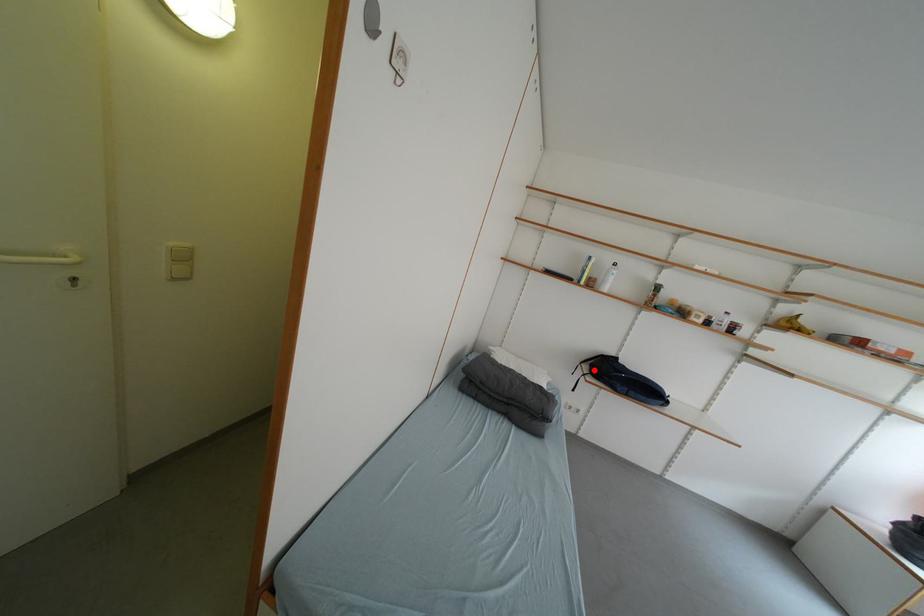
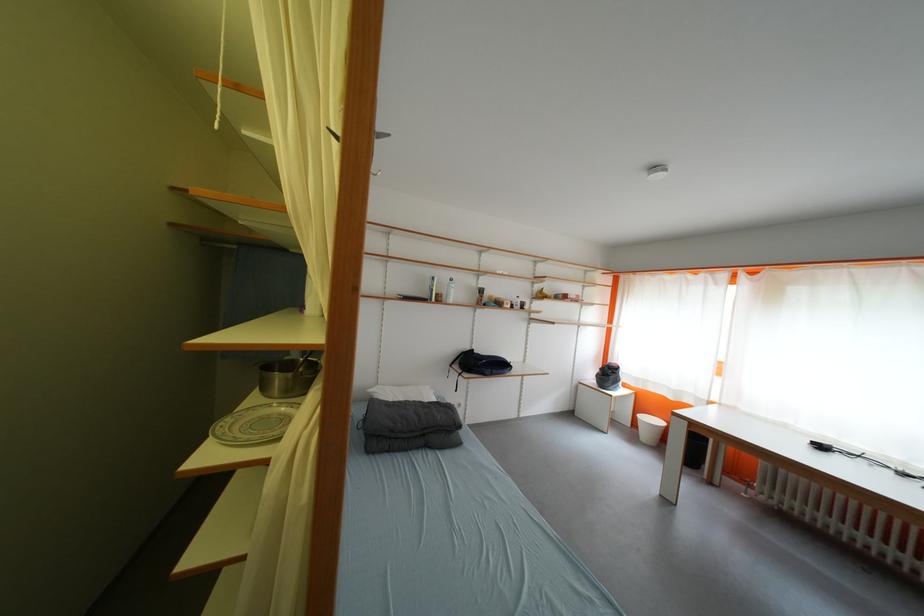
Question: I am providing you with two images of the same scene from different viewpoints. Image1 has a red point marked. In image2, the corresponding 3D location appears at what relative position? Reply with the corresponding letter.

Choices:
 (A) Closer
 (B) Farther

Answer: (B)